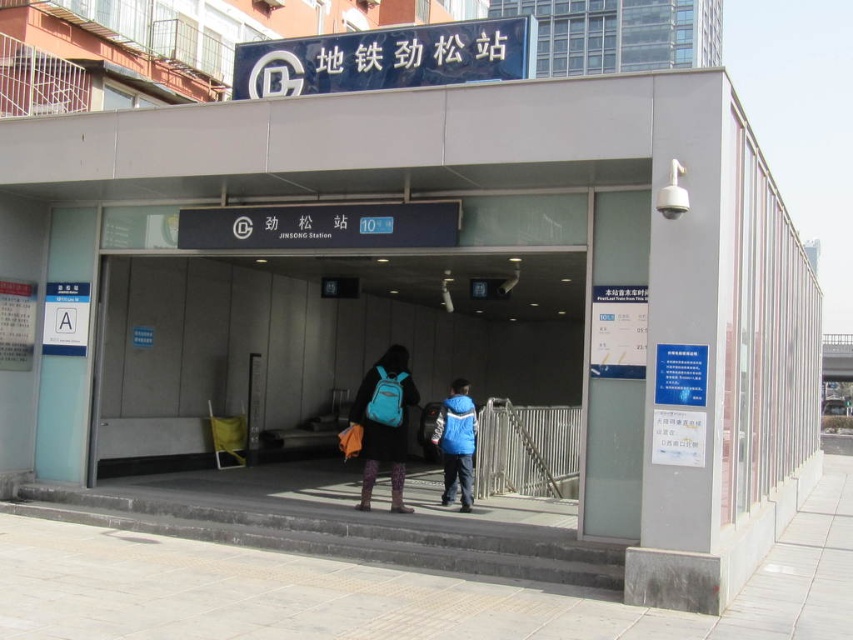
Question: Which point appears closest to the camera in this image?

Choices:
 (A) (364, 458)
 (B) (462, 508)

Answer: (A)

Question: Which of the following is the closest to the observer?

Choices:
 (A) (450, 396)
 (B) (395, 364)

Answer: (B)

Question: Can you confirm if matte blue backpack at center is positioned to the right of blue fabric backpack at center?

Choices:
 (A) yes
 (B) no

Answer: (B)

Question: Does matte blue backpack at center appear on the right side of blue fabric backpack at center?

Choices:
 (A) yes
 (B) no

Answer: (B)

Question: Does matte blue backpack at center appear on the left side of blue fabric backpack at center?

Choices:
 (A) no
 (B) yes

Answer: (B)